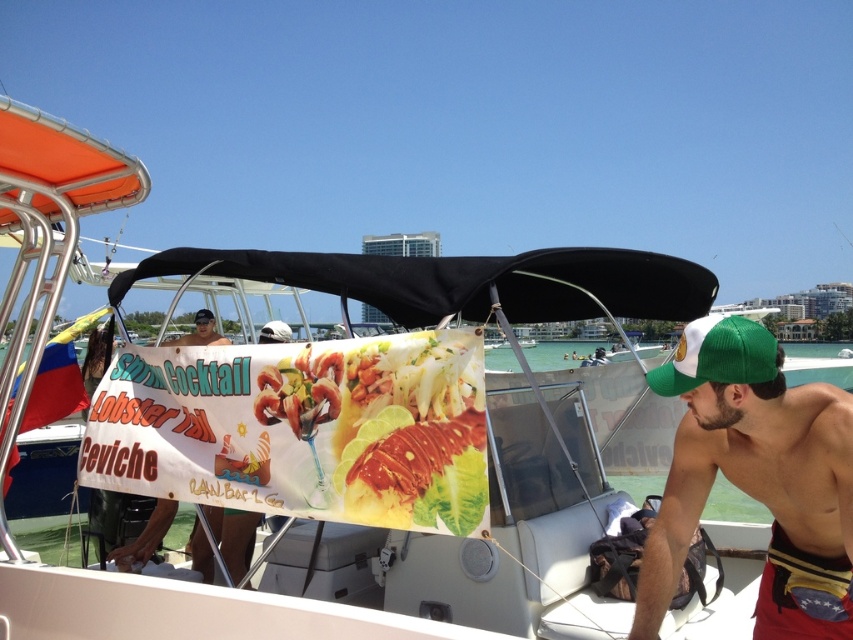
Can you confirm if green fabric cap at right is wider than matte black signboard at center?

Correct, the width of green fabric cap at right exceeds that of matte black signboard at center.

In the scene shown: Between green fabric cap at right and matte black signboard at center, which one appears on the left side from the viewer's perspective?

matte black signboard at center is more to the left.

Is point (799, 614) farther from camera compared to point (218, 509)?

That is False.

The image size is (853, 640). I want to click on green fabric cap at right, so click(x=756, y=477).

Which of these two, green fabric cap at right or green fabric baseball cap at right, stands shorter?

Standing shorter between the two is green fabric baseball cap at right.

Between green fabric cap at right and green fabric baseball cap at right, which one appears on the right side from the viewer's perspective?

green fabric cap at right

The width and height of the screenshot is (853, 640). Identify the location of green fabric cap at right. (756, 477).

Between point (427, 420) and point (737, 337), which one is positioned behind?

The point (427, 420) is behind.

Is point (281, 374) positioned before point (735, 320)?

No, (281, 374) is behind (735, 320).

This screenshot has height=640, width=853. In order to click on shiny lobster at center in this screenshot , I will do `click(380, 429)`.